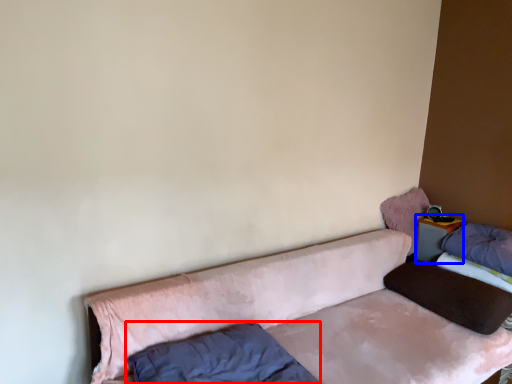
Question: Among these objects, which one is farthest to the camera, pillow (highlighted by a red box) or table (highlighted by a blue box)?

Choices:
 (A) pillow
 (B) table

Answer: (B)